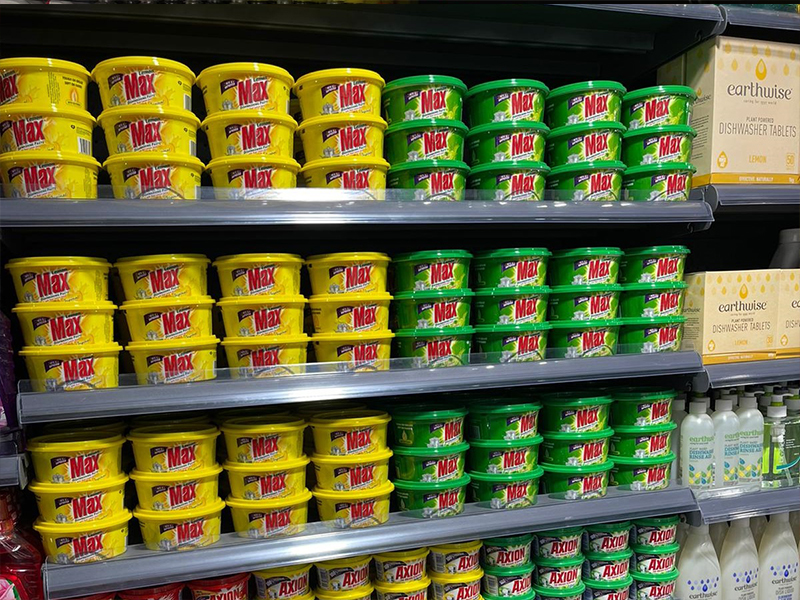
Where is `edge of shelf`? Image resolution: width=800 pixels, height=600 pixels. edge of shelf is located at coordinates (326, 528), (354, 388), (420, 209), (742, 191), (749, 375), (745, 504).